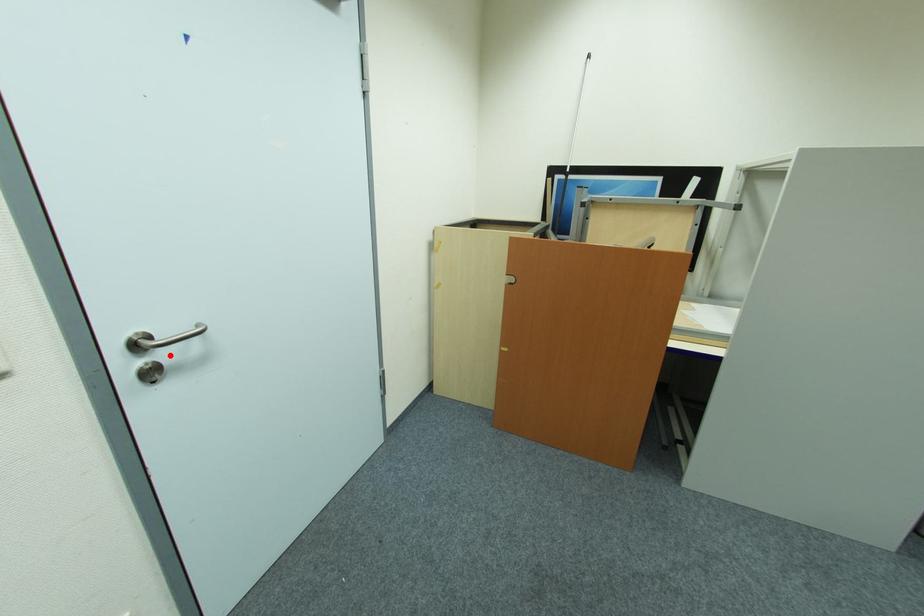
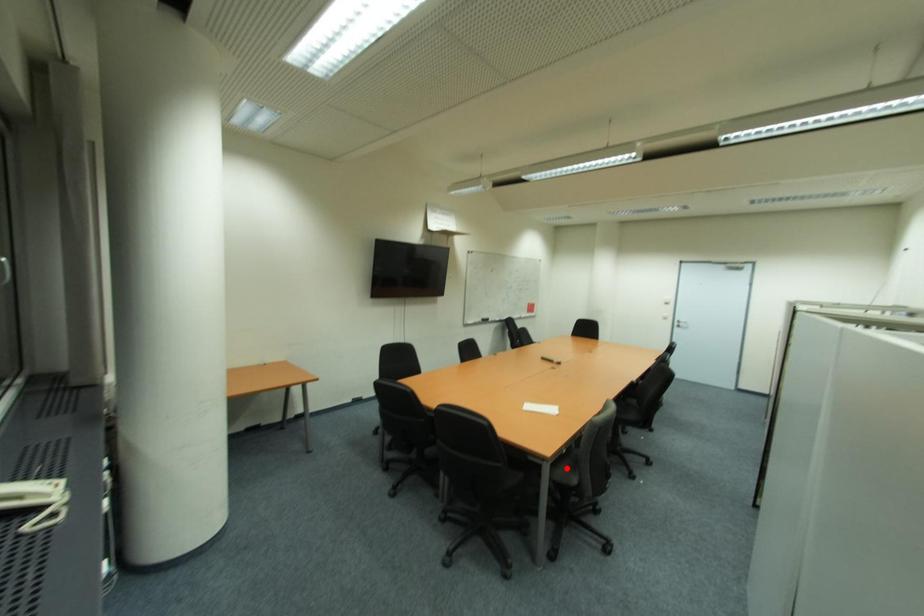
I am providing you with two images of the same scene from different viewpoints. A red point is marked on the first image and another point is marked on the second image. Are the points marked in image1 and image2 representing the same 3D position?

No